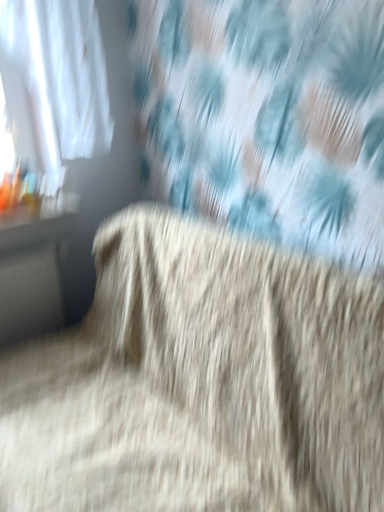
Question: In the image, is matte black table at left positioned in front of or behind fuzzy beige carpet at center?

Choices:
 (A) front
 (B) behind

Answer: (B)

Question: Looking at the image, does matte black table at left seem bigger or smaller compared to fuzzy beige carpet at center?

Choices:
 (A) small
 (B) big

Answer: (A)

Question: From a real-world perspective, is matte black table at left physically located above or below fuzzy beige carpet at center?

Choices:
 (A) above
 (B) below

Answer: (A)

Question: In terms of height, does fuzzy beige carpet at center look taller or shorter compared to matte black table at left?

Choices:
 (A) short
 (B) tall

Answer: (B)

Question: Choose the correct answer: Is fuzzy beige carpet at center inside matte black table at left or outside it?

Choices:
 (A) outside
 (B) inside

Answer: (A)

Question: Visually, is fuzzy beige carpet at center positioned to the left or to the right of matte black table at left?

Choices:
 (A) left
 (B) right

Answer: (B)

Question: In the image, is fuzzy beige carpet at center positioned in front of or behind matte black table at left?

Choices:
 (A) front
 (B) behind

Answer: (A)